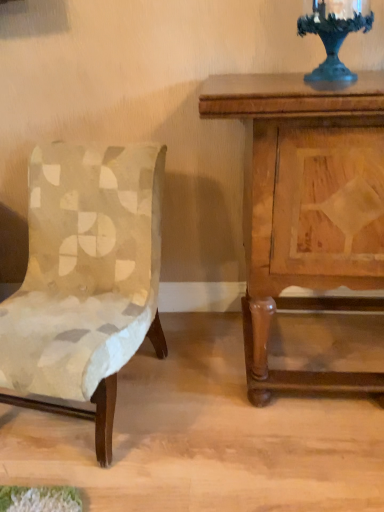
Identify the location of empty space that is in between wooden nightstand at right and velvet beige chair at left. The image size is (384, 512). (201, 407).